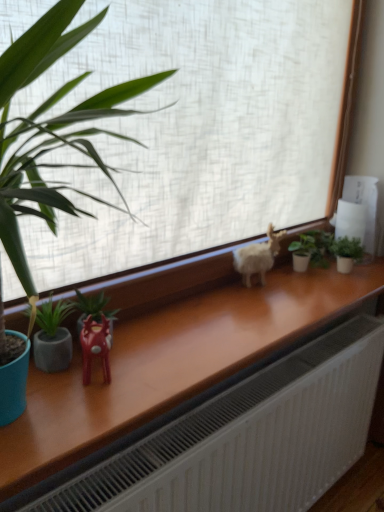
Question: Looking at their shapes, would you say shiny red plastic reindeer at center-left is wider or thinner than green matte plant at left, which is counted as the 1th houseplant, starting from the left?

Choices:
 (A) thin
 (B) wide

Answer: (B)

Question: From the image's perspective, is shiny red plastic reindeer at center-left located above or below green matte plant at left, which is counted as the 1th houseplant, starting from the left?

Choices:
 (A) below
 (B) above

Answer: (A)

Question: Estimate the real-world distances between objects in this image. Which object is closer to the white matte window at center?

Choices:
 (A) white fluffy goat at center
 (B) green matte plant at left, marked as the 1th houseplant in a front-to-back arrangement
 (C) green matte plant at center-right, positioned as the 4th houseplant in front-to-back order
 (D) green matte plant at right, which is the 3th houseplant from front to back
 (E) green matte houseplant at center, arranged as the second houseplant when viewed from the front

Answer: (A)

Question: Which object is the farthest from the white matte window at center?

Choices:
 (A) shiny red plastic reindeer at center-left
 (B) green matte houseplant at center, which appears as the third houseplant when viewed from the right
 (C) green matte plant at center-right, the first houseplant positioned from the back
 (D) green matte plant at right, the 1th houseplant viewed from the right
 (E) white fluffy goat at center

Answer: (D)